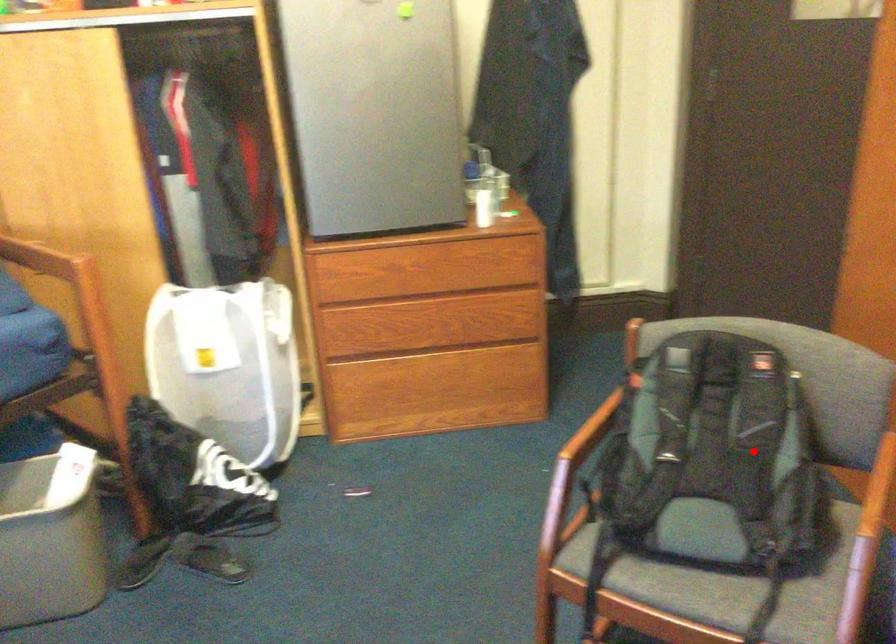
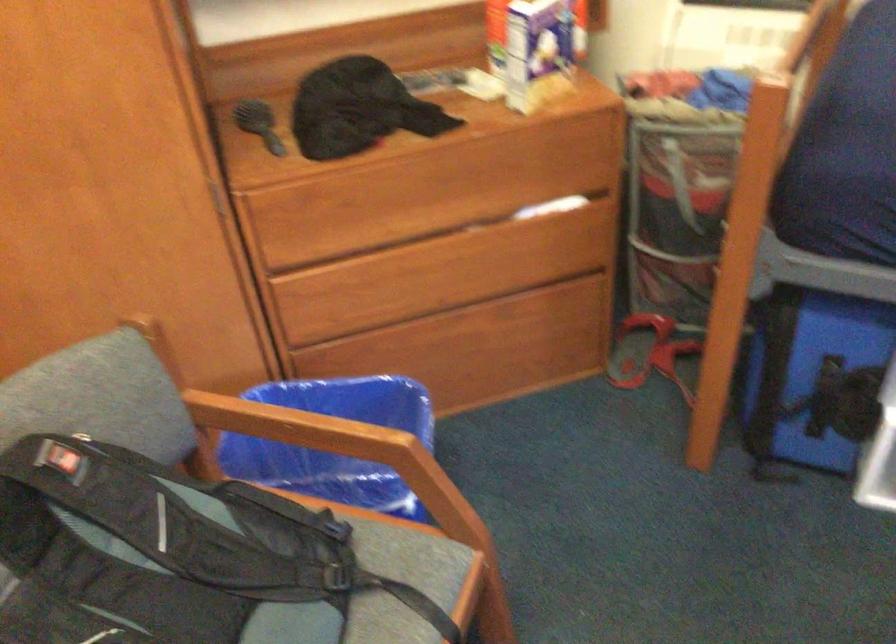
Question: I am providing you with two images of the same scene from different viewpoints. In image1, a red point is highlighted. Considering the same 3D point in image2, which of the following is correct?

Choices:
 (A) It is closer
 (B) It is farther

Answer: (A)